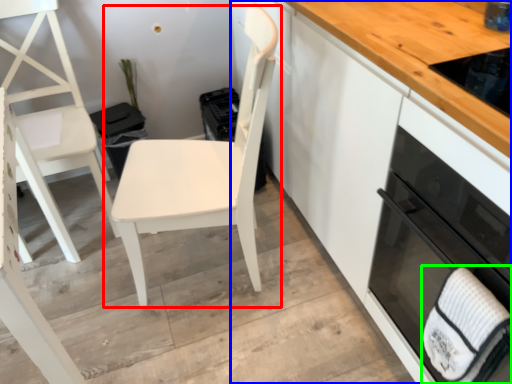
Question: Considering the real-world distances, which object is closest to chair (highlighted by a red box)? cabinetry (highlighted by a blue box) or hand towel (highlighted by a green box).

Choices:
 (A) cabinetry
 (B) hand towel

Answer: (A)